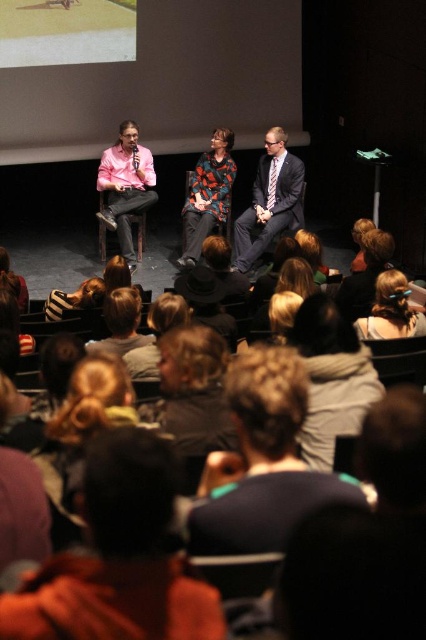
Looking at this image, you are an attendee at the panel discussion and want to wave to both the person in the pink satin shirt at left and the printed fabric jacket at center. Since you can only wave to one person at a time, which one should you wave to first if you want to start with the one closer to your left side?

You should wave to the pink satin shirt at left first because it is positioned to the left of the printed fabric jacket at center, making it closer to your left side.